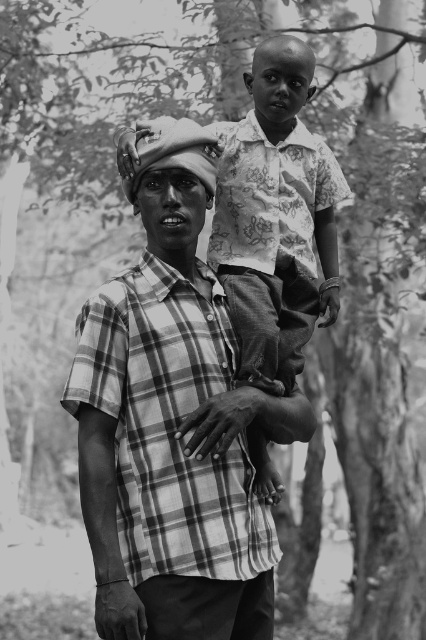
Question: Which of the following is the farthest from the observer?

Choices:
 (A) (307, 193)
 (B) (204, 340)

Answer: (A)

Question: Is plaid fabric shirt at center in front of patterned fabric shirt at upper center?

Choices:
 (A) no
 (B) yes

Answer: (B)

Question: Which of the following is the farthest from the observer?

Choices:
 (A) [310, 150]
 (B) [195, 444]

Answer: (A)

Question: Can you confirm if plaid fabric shirt at center is wider than patterned fabric shirt at upper center?

Choices:
 (A) no
 (B) yes

Answer: (B)

Question: Is plaid fabric shirt at center positioned before patterned fabric shirt at upper center?

Choices:
 (A) yes
 (B) no

Answer: (A)